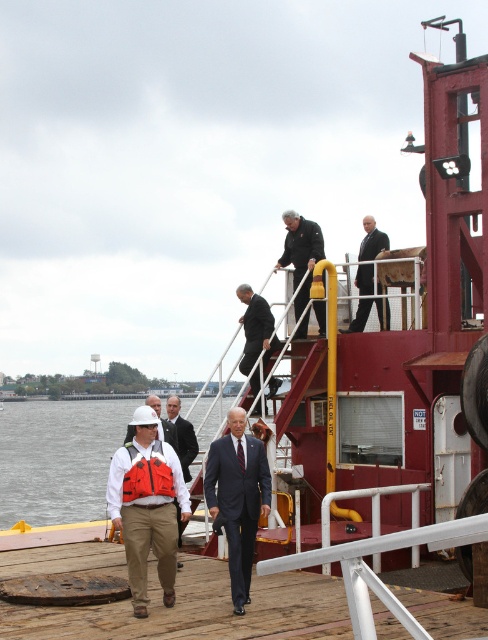
Can you confirm if dark gray uniform at upper center is shorter than white matte helmet at center?

No, dark gray uniform at upper center is not shorter than white matte helmet at center.

Who is lower down, dark gray uniform at upper center or white matte helmet at center?

white matte helmet at center is below.

Find the location of a particular element. The height and width of the screenshot is (640, 488). dark gray uniform at upper center is located at coordinates (301, 253).

Is brown wooden deck at lower center closer to camera compared to clear water at lower left?

Yes, it is.

Is brown wooden deck at lower center positioned at the back of clear water at lower left?

No, brown wooden deck at lower center is closer to the viewer.

The image size is (488, 640). I want to click on brown wooden deck at lower center, so click(x=198, y=611).

At what (x,y) coordinates should I click in order to perform the action: click on brown wooden deck at lower center. Please return your answer as a coordinate pair (x, y). Looking at the image, I should click on (198, 611).

Is brown wooden deck at lower center further to the viewer compared to dark gray suit at upper center?

No, it is not.

Can you confirm if brown wooden deck at lower center is taller than dark gray suit at upper center?

No, brown wooden deck at lower center is not taller than dark gray suit at upper center.

Locate an element on the screen. This screenshot has height=640, width=488. brown wooden deck at lower center is located at coordinates (198, 611).

Image resolution: width=488 pixels, height=640 pixels. Find the location of `brown wooden deck at lower center`. brown wooden deck at lower center is located at coordinates (198, 611).